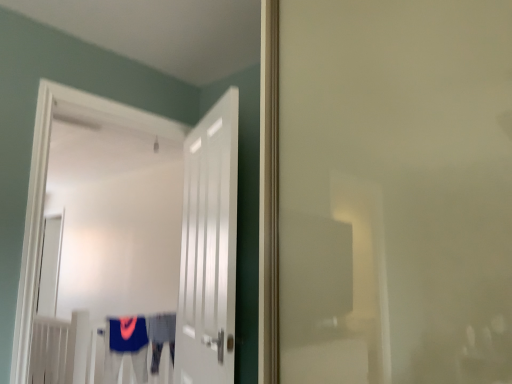
Question: Is white glossy door at center, acting as the first door starting from the left, in front of blue fabric robe at center, which ranks as the 2th robe in left-to-right order?

Choices:
 (A) yes
 (B) no

Answer: (A)

Question: From the image's perspective, would you say white glossy door at center, the 2th door from the right, is positioned over blue fabric robe at center, which ranks as the 2th robe in left-to-right order?

Choices:
 (A) yes
 (B) no

Answer: (A)

Question: Is white glossy door at center, acting as the first door starting from the left, aimed at blue fabric robe at center, which ranks as the 2th robe in left-to-right order?

Choices:
 (A) no
 (B) yes

Answer: (A)

Question: Is white glossy door at center, acting as the first door starting from the left, directly adjacent to blue fabric robe at center, which ranks as the 2th robe in left-to-right order?

Choices:
 (A) no
 (B) yes

Answer: (A)

Question: Can you confirm if white glossy door at center, acting as the first door starting from the left, is taller than blue fabric robe at center, the first robe from the right?

Choices:
 (A) yes
 (B) no

Answer: (A)

Question: From a real-world perspective, is blue fabric robe at center, the first robe from the right, above or below blue fabric robe at lower center, the 2th robe in the right-to-left sequence?

Choices:
 (A) below
 (B) above

Answer: (A)

Question: Is blue fabric robe at center, which ranks as the 2th robe in left-to-right order, taller or shorter than blue fabric robe at lower center, the 2th robe in the right-to-left sequence?

Choices:
 (A) short
 (B) tall

Answer: (B)

Question: From the image's perspective, is blue fabric robe at center, which ranks as the 2th robe in left-to-right order, located above or below blue fabric robe at lower center, which appears as the 1th robe when viewed from the left?

Choices:
 (A) below
 (B) above

Answer: (A)

Question: Is blue fabric robe at center, the first robe from the right, spatially inside blue fabric robe at lower center, which appears as the 1th robe when viewed from the left, or outside of it?

Choices:
 (A) inside
 (B) outside

Answer: (B)

Question: Choose the correct answer: Is white glossy door at center, the 2th door from the right, inside blue fabric robe at center, which ranks as the 2th robe in left-to-right order, or outside it?

Choices:
 (A) outside
 (B) inside

Answer: (A)

Question: Is white glossy door at center, acting as the first door starting from the left, bigger or smaller than blue fabric robe at center, which ranks as the 2th robe in left-to-right order?

Choices:
 (A) small
 (B) big

Answer: (B)

Question: Looking at their shapes, would you say white glossy door at center, acting as the first door starting from the left, is wider or thinner than blue fabric robe at center, the first robe from the right?

Choices:
 (A) wide
 (B) thin

Answer: (B)

Question: Considering their positions, is white glossy door at center, the 2th door from the right, located in front of or behind blue fabric robe at center, which ranks as the 2th robe in left-to-right order?

Choices:
 (A) behind
 (B) front

Answer: (B)

Question: Is blue fabric robe at center, which ranks as the 2th robe in left-to-right order, situated inside white glossy door at center, the 2th door from the right, or outside?

Choices:
 (A) inside
 (B) outside

Answer: (B)

Question: In terms of size, does blue fabric robe at center, the first robe from the right, appear bigger or smaller than white glossy door at center, the 2th door from the right?

Choices:
 (A) small
 (B) big

Answer: (A)